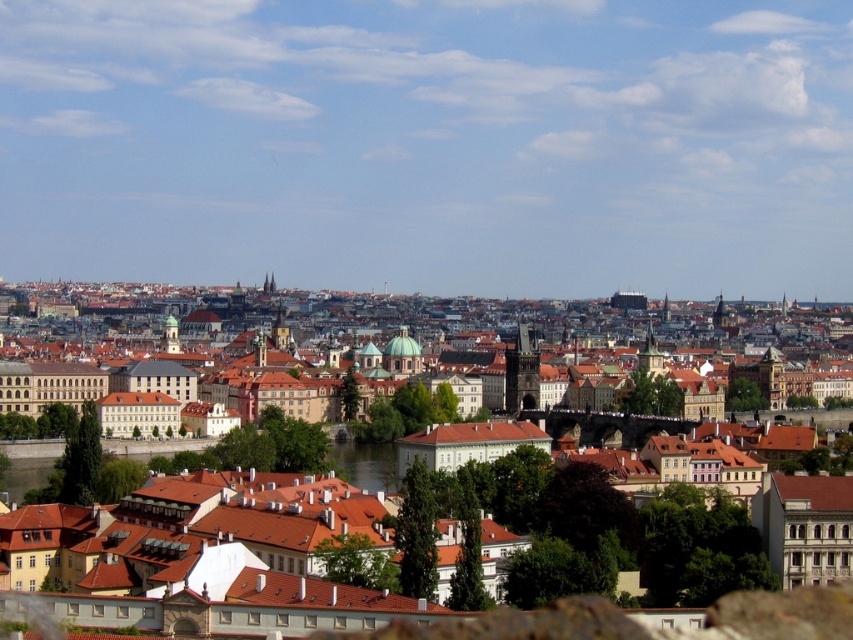
Is point (173, 294) closer to viewer compared to point (152, 445)?

No, it is not.

Which of these two, brown stone buildings at center or greenish water at center, stands taller?

brown stone buildings at center is taller.

Who is more forward, [502,305] or [158,444]?

Point [158,444]

Locate an element on the screen. brown stone buildings at center is located at coordinates (334, 314).